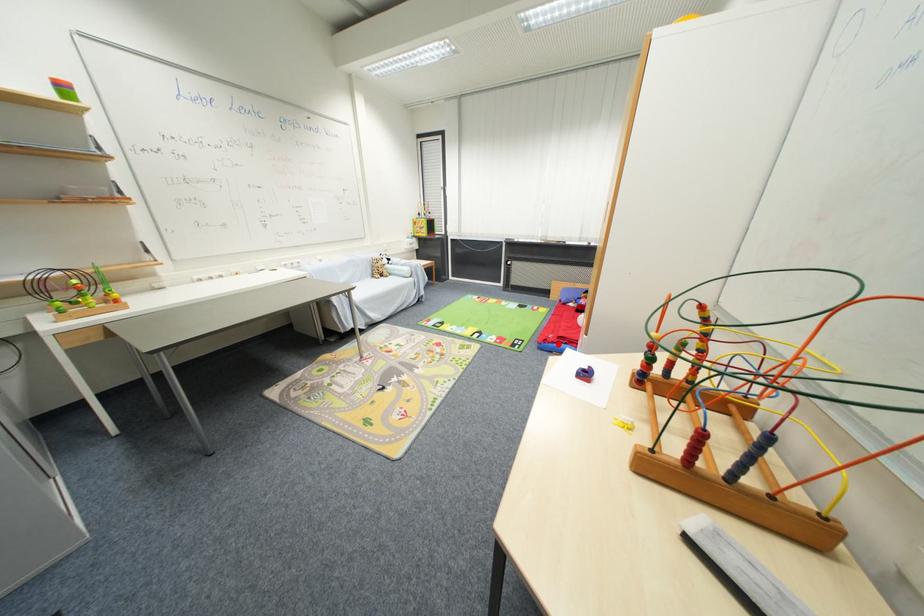
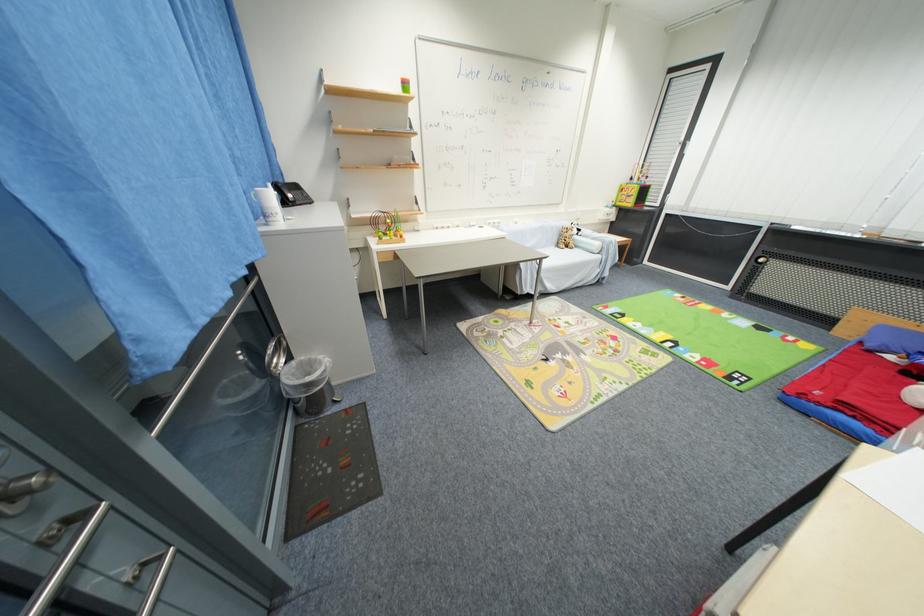
Where in the second image is the point corresponding to the highlighted location from the first image?

(824, 406)